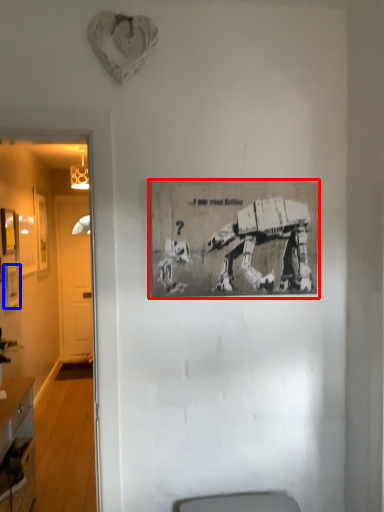
Question: Among these objects, which one is nearest to the camera, picture frame (highlighted by a red box) or picture frame (highlighted by a blue box)?

Choices:
 (A) picture frame
 (B) picture frame

Answer: (A)